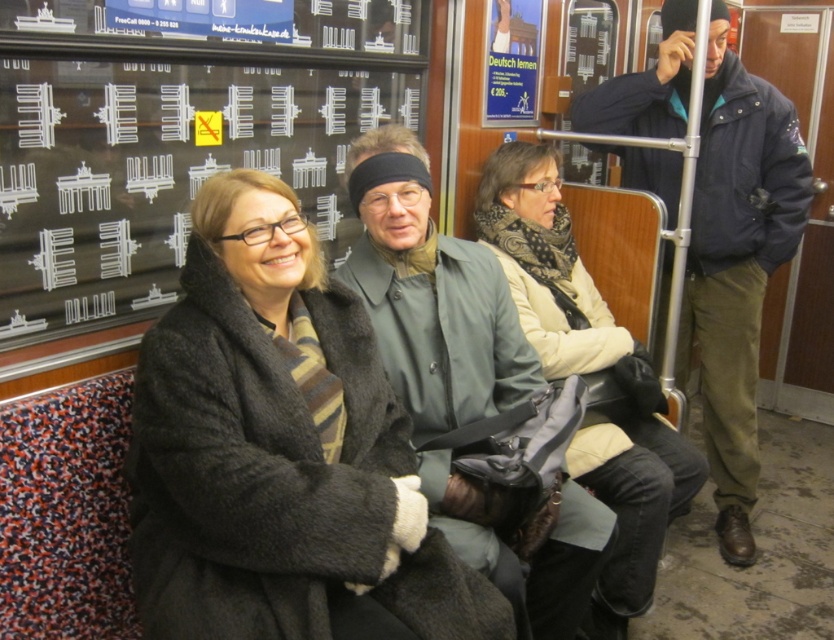
You are a passenger on a train and you see the dark gray wool coat at center. Where exactly is it located in the image?

The dark gray wool coat at center is located at point 0.706 on the x axis and 0.337 on the y axis.

You are a passenger on a train and need to place a small bag on the seat next to you. The bag requires a space of at least 10 cm in width. Given the green matte coat at center is occupying the seat, can you determine if there is enough space left on the seat for the bag?

The position of green matte coat at center is at point [431,296], but without information about the seat dimensions or the coat size, it is impossible to determine if there is enough space for the bag.

You are a passenger on a train and see two coats at the center of the scene. Which coat is closer to the floor, the dark gray wool coat at center or the green matte coat at center?

The dark gray wool coat at center is positioned under the green matte coat at center, so it is closer to the floor.